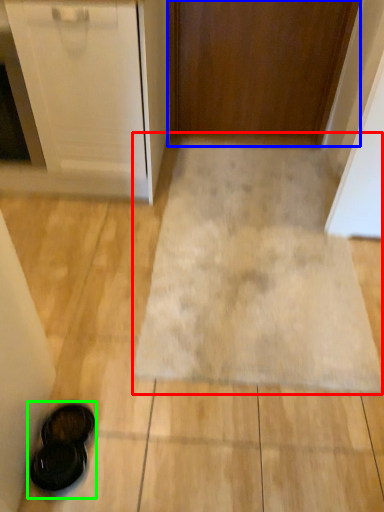
Question: Based on their relative distances, which object is nearer to bath mat (highlighted by a red box)? Choose from door (highlighted by a blue box) and footwear (highlighted by a green box).

Choices:
 (A) door
 (B) footwear

Answer: (B)